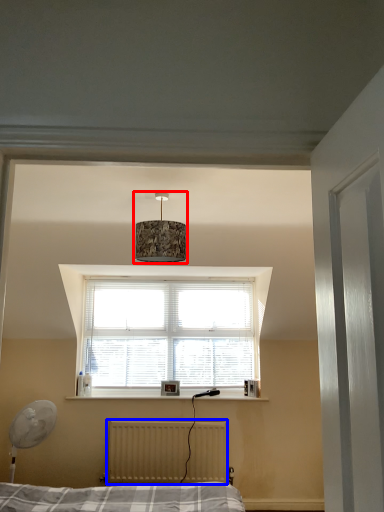
Question: Which of the following is the farthest to the observer, lamp (highlighted by a red box) or radiator (highlighted by a blue box)?

Choices:
 (A) lamp
 (B) radiator

Answer: (B)